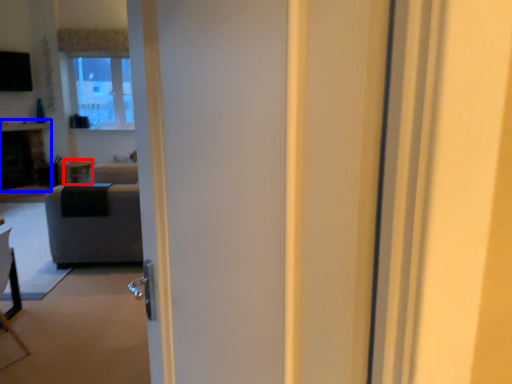
Question: Which object is further to the camera taking this photo, side table (highlighted by a red box) or fireplace (highlighted by a blue box)?

Choices:
 (A) side table
 (B) fireplace

Answer: (A)